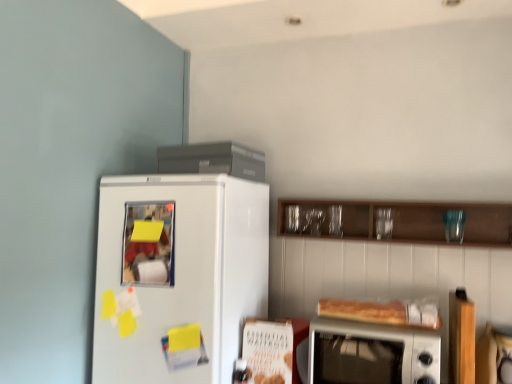
Question: Considering the positions of silver metallic microwave oven at lower right and satin gray refrigerator at upper center in the image, is silver metallic microwave oven at lower right taller or shorter than satin gray refrigerator at upper center?

Choices:
 (A) tall
 (B) short

Answer: (A)

Question: Choose the correct answer: Is silver metallic microwave oven at lower right inside satin gray refrigerator at upper center or outside it?

Choices:
 (A) outside
 (B) inside

Answer: (A)

Question: Which of these objects is positioned closest to the satin gray refrigerator at upper center?

Choices:
 (A) white glossy refrigerator at left
 (B) wooden cabinet at upper center
 (C) silver metallic microwave oven at lower right

Answer: (A)

Question: Which is nearer to the white glossy refrigerator at left?

Choices:
 (A) silver metallic microwave oven at lower right
 (B) wooden cabinet at upper center
 (C) satin gray refrigerator at upper center

Answer: (C)